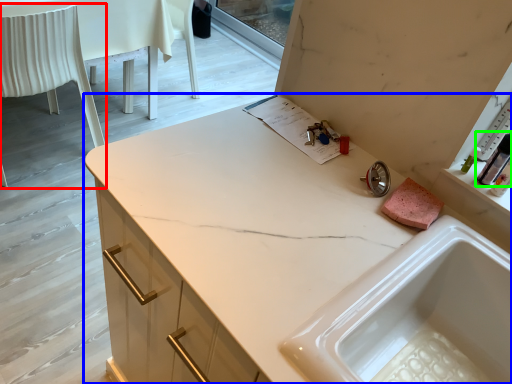
Question: Considering the real-world distances, which object is closest to chair (highlighted by a red box)? countertop (highlighted by a blue box) or toiletry (highlighted by a green box).

Choices:
 (A) countertop
 (B) toiletry

Answer: (A)